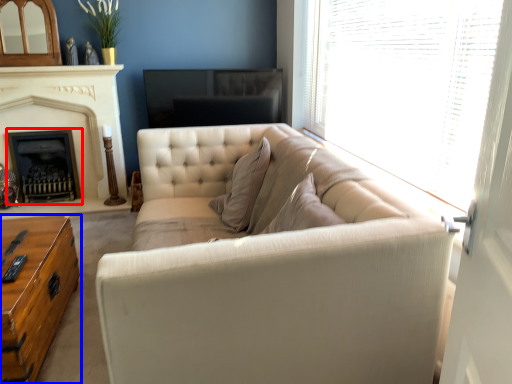
Question: Which object appears farthest to the camera in this image, fireplace (highlighted by a red box) or table (highlighted by a blue box)?

Choices:
 (A) fireplace
 (B) table

Answer: (A)